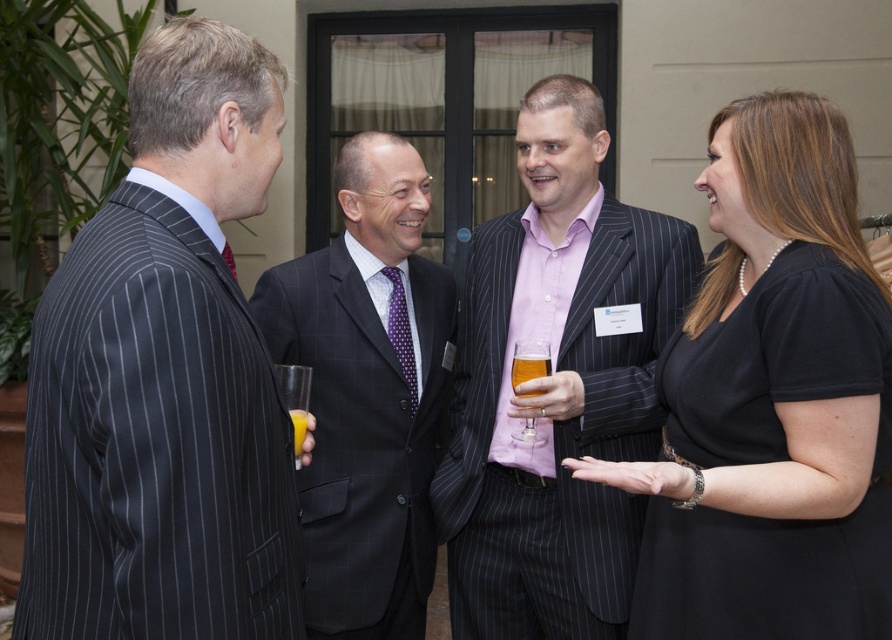
You are standing at the origin point in the image. Which direction should you move to reach the dark gray pinstripe suit at left?

Since the dark gray pinstripe suit at left is located at coordinates approximately 0.591 on the x axis and 0.185 on the y axis, you should move to the right and slightly downward to reach it from the origin point.

You are organizing a photo shoot and need to place the black matte dress at center and the pink striped suit at center in a way that they don not overlap. Given their sizes, which one should you place first to ensure there is enough space?

The black matte dress at center occupies less space than the pink striped suit at center, so you should place the pink striped suit at center first to ensure there is enough space for both.